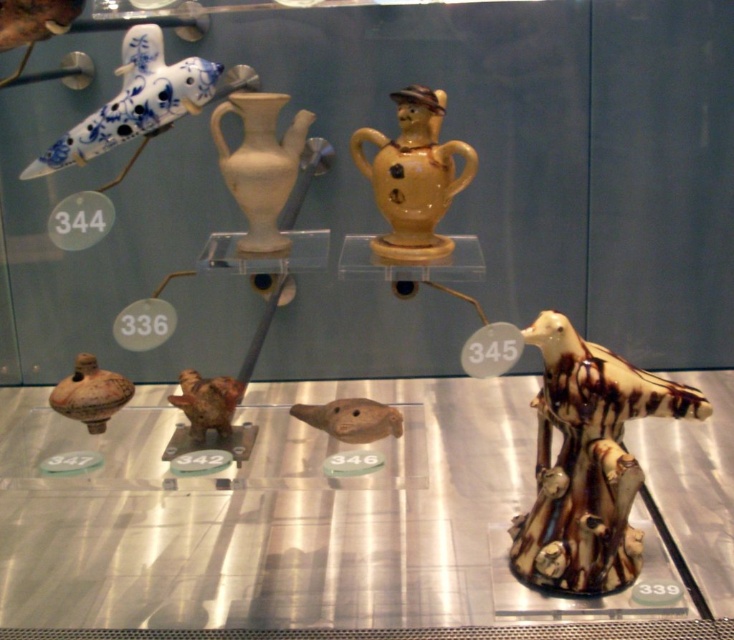
Question: Is matte beige bird at center to the right of brown matte bird at center from the viewer's perspective?

Choices:
 (A) yes
 (B) no

Answer: (A)

Question: Estimate the real-world distances between objects in this image. Which object is farther from the brown glaze ceramic bird at lower right?

Choices:
 (A) yellow matte vase at center
 (B) blue and white glazed bird at upper left
 (C) brown matte bird at center

Answer: (B)

Question: Which of the following is the farthest from the observer?

Choices:
 (A) (363, 442)
 (B) (410, 173)
 (C) (219, 436)
 (D) (161, 60)

Answer: (C)

Question: Which object appears farthest from the camera in this image?

Choices:
 (A) blue and white ceramic bird at upper left
 (B) yellow matte vase at center
 (C) white matte vase at upper center
 (D) blue and white glazed bird at upper left

Answer: (B)

Question: Observing the image, what is the correct spatial positioning of translucent glass table at lower center in reference to white matte vase at upper center?

Choices:
 (A) above
 (B) below

Answer: (B)

Question: Can you confirm if translucent glass table at lower center is wider than brown glaze ceramic bird at lower right?

Choices:
 (A) yes
 (B) no

Answer: (A)